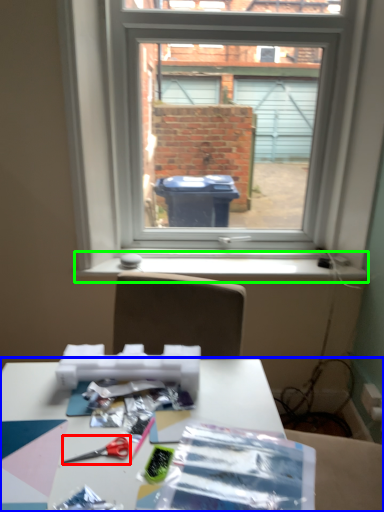
Question: Which is nearer to the scissors (highlighted by a red box)? table (highlighted by a blue box) or window sill (highlighted by a green box).

Choices:
 (A) table
 (B) window sill

Answer: (A)